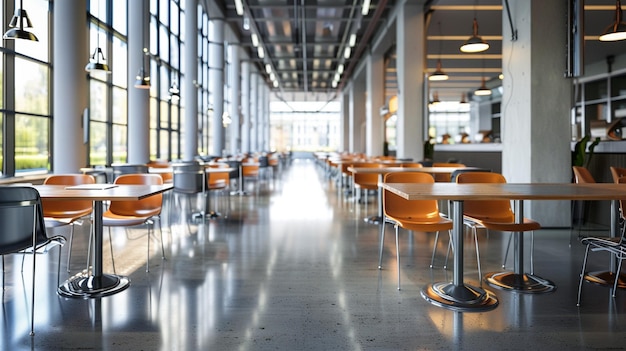
Locate an element on the screen. This screenshot has height=351, width=626. round table bases is located at coordinates [x=464, y=290], [x=520, y=281], [x=88, y=283], [x=212, y=215], [x=372, y=214].